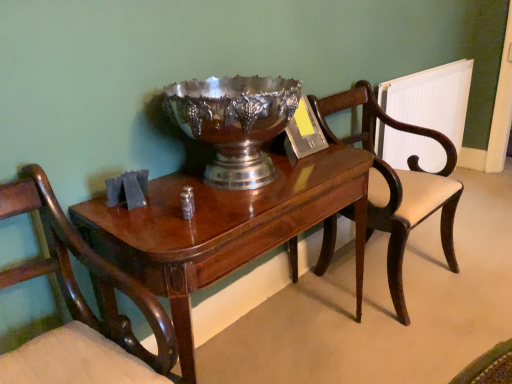
Find the location of a particular element. vacant space to the right of mahogany wood table at center is located at coordinates (416, 343).